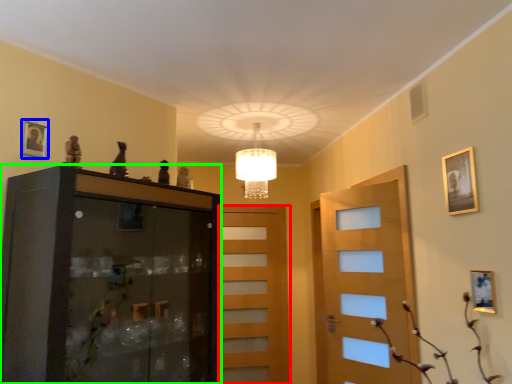
Question: Considering the real-world distances, which object is closest to door (highlighted by a red box)? picture frame (highlighted by a blue box) or cabinetry (highlighted by a green box).

Choices:
 (A) picture frame
 (B) cabinetry

Answer: (B)